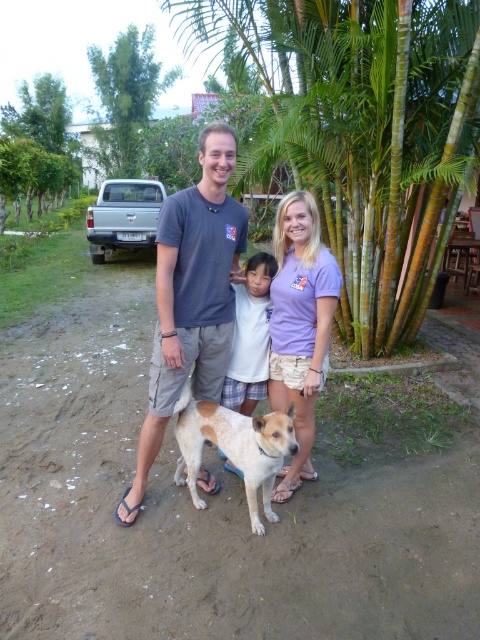
Question: Is dark gray t-shirt at center wider than white cotton shirt at center?

Choices:
 (A) yes
 (B) no

Answer: (A)

Question: Among these objects, which one is nearest to the camera?

Choices:
 (A) white cotton shirt at center
 (B) green leafy palm tree at center
 (C) brown speckled fur dog at center

Answer: (C)

Question: Based on their relative distances, which object is nearer to the lavender cotton t-shirt at center?

Choices:
 (A) brown speckled fur dog at center
 (B) green leafy palm tree at center
 (C) dark gray t-shirt at center

Answer: (A)

Question: Does dark gray t-shirt at center appear over white cotton shirt at center?

Choices:
 (A) no
 (B) yes

Answer: (B)

Question: Considering the real-world distances, which object is closest to the green leafy palm tree at center?

Choices:
 (A) lavender cotton t-shirt at center
 (B) brown speckled fur dog at center
 (C) white cotton shirt at center

Answer: (B)

Question: Considering the relative positions of brown speckled fur dog at center and white cotton shirt at center in the image provided, where is brown speckled fur dog at center located with respect to white cotton shirt at center?

Choices:
 (A) right
 (B) left

Answer: (B)